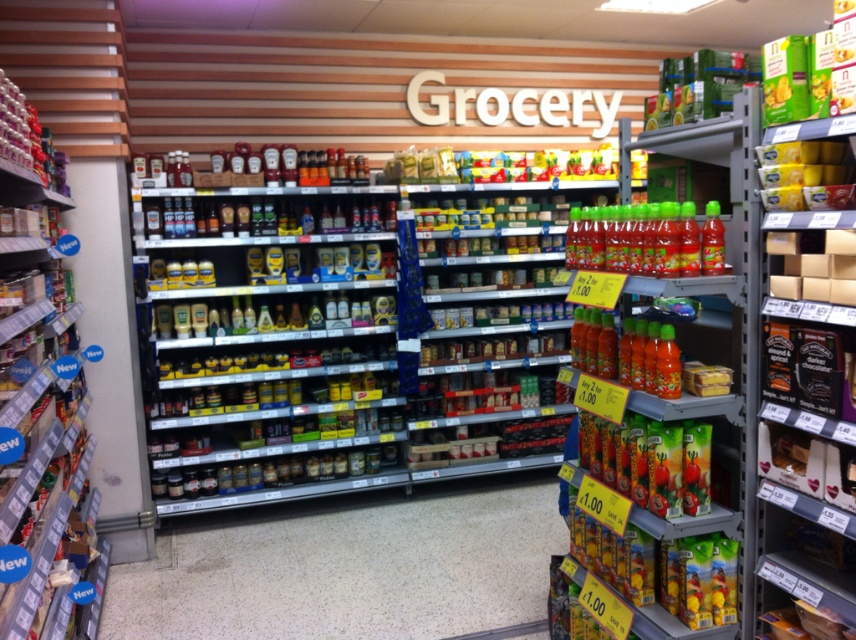
Question: Is green plastic juice bottles at right positioned at the back of yellow plastic container at upper right?

Choices:
 (A) no
 (B) yes

Answer: (B)

Question: Is metallic silver canisters at center above green plastic juice at lower right?

Choices:
 (A) yes
 (B) no

Answer: (B)

Question: Which of the following is the closest to the observer?

Choices:
 (A) (789, 209)
 (B) (625, 234)
 (C) (657, 401)

Answer: (A)

Question: Among these objects, which one is farthest from the camera?

Choices:
 (A) green plastic juice bottles at right
 (B) yellow plastic container at upper right
 (C) metallic silver canisters at left
 (D) metallic silver canisters at center

Answer: (D)

Question: Estimate the real-world distances between objects in this image. Which object is farther from the green matte juice bottles at right?

Choices:
 (A) green plastic juice bottles at right
 (B) green plastic juice at lower right

Answer: (B)

Question: Is green plastic juice bottles at right to the left of green plastic juice at lower right from the viewer's perspective?

Choices:
 (A) no
 (B) yes

Answer: (A)